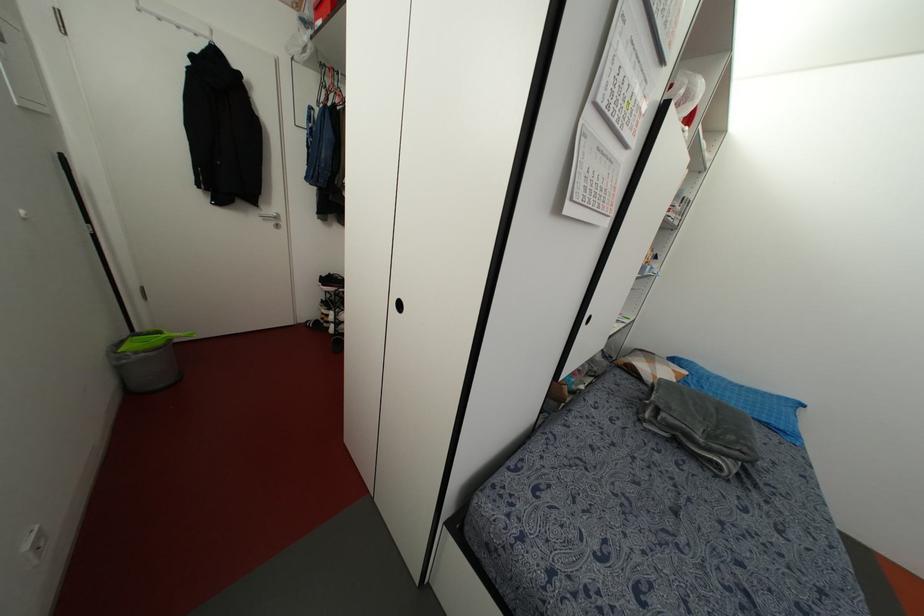
The location [144,363] corresponds to which object?

It corresponds to the grey bucket in the image.